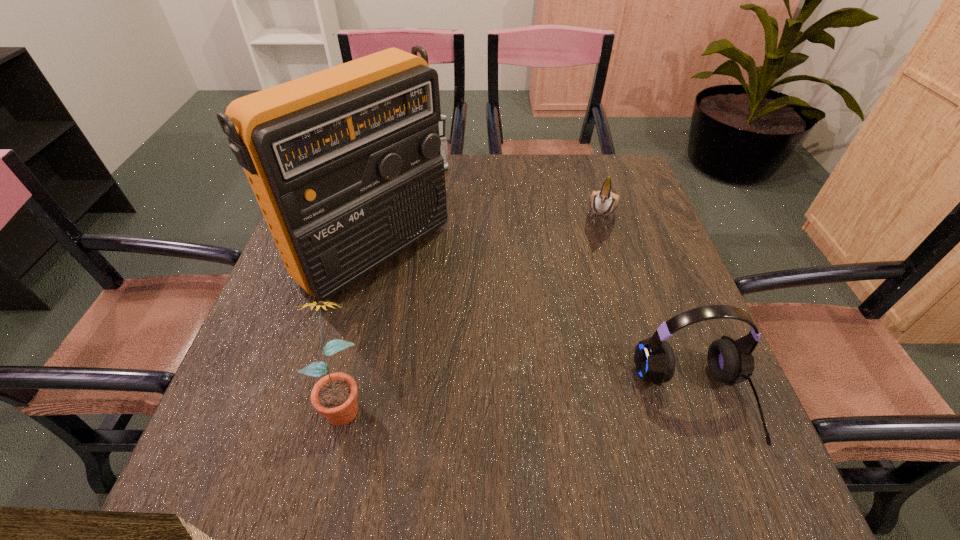
This screenshot has height=540, width=960. Find the location of `vacant space on the desktop that is between the sunflower and the headset and is positioned at the face of the bird`. vacant space on the desktop that is between the sunflower and the headset and is positioned at the face of the bird is located at coordinates click(544, 400).

You are a GUI agent. You are given a task and a screenshot of the screen. Output one action in this format:
    pyautogui.click(x=<x>, y=<y>)
    Task: Click on the vacant space on the desktop that is between the fourth shortest object and the headset and is positioned on the front-facing side of the radio receiver
    The width and height of the screenshot is (960, 540).
    Given the screenshot: What is the action you would take?
    pyautogui.click(x=571, y=400)

Identify the location of vacant spot on the desktop that is between the fourth shortest object and the headset and is positioned on the front-facing side of the cellular telephone. (542, 400).